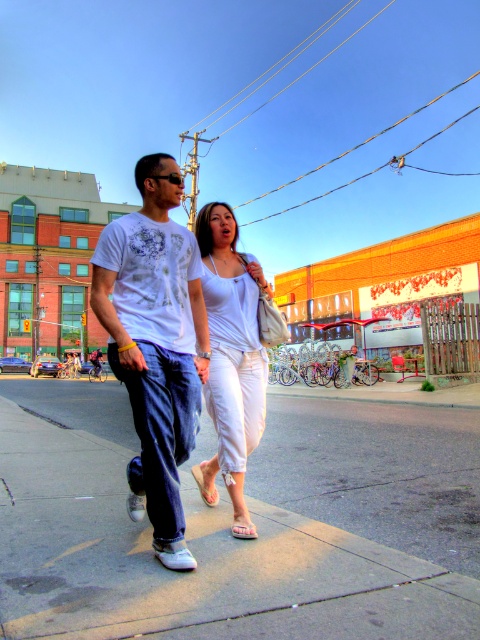
Can you confirm if white matte t-shirt at center is shorter than white cotton pants at center?

In fact, white matte t-shirt at center may be taller than white cotton pants at center.

Who is positioned more to the left, white matte t-shirt at center or white cotton pants at center?

white matte t-shirt at center

Is point (124, 349) positioned after point (211, 484)?

No, (124, 349) is in front of (211, 484).

Locate an element on the screen. white matte t-shirt at center is located at coordinates (156, 344).

From the picture: Can you confirm if gray concrete sidewalk at center is shorter than white cotton pants at center?

Yes, gray concrete sidewalk at center is shorter than white cotton pants at center.

Does gray concrete sidewalk at center have a larger size compared to white cotton pants at center?

Correct, gray concrete sidewalk at center is larger in size than white cotton pants at center.

Where is `gray concrete sidewalk at center`? Image resolution: width=480 pixels, height=640 pixels. gray concrete sidewalk at center is located at coordinates (196, 557).

Does point (430, 602) lie in front of point (95, 301)?

Yes, point (430, 602) is in front of point (95, 301).

Who is positioned more to the right, gray concrete sidewalk at center or white matte t-shirt at center?

From the viewer's perspective, gray concrete sidewalk at center appears more on the right side.

Which is behind, point (61, 636) or point (149, 243)?

The point (149, 243) is behind.

Find the location of a particular element. This screenshot has height=640, width=480. gray concrete sidewalk at center is located at coordinates pyautogui.click(x=196, y=557).